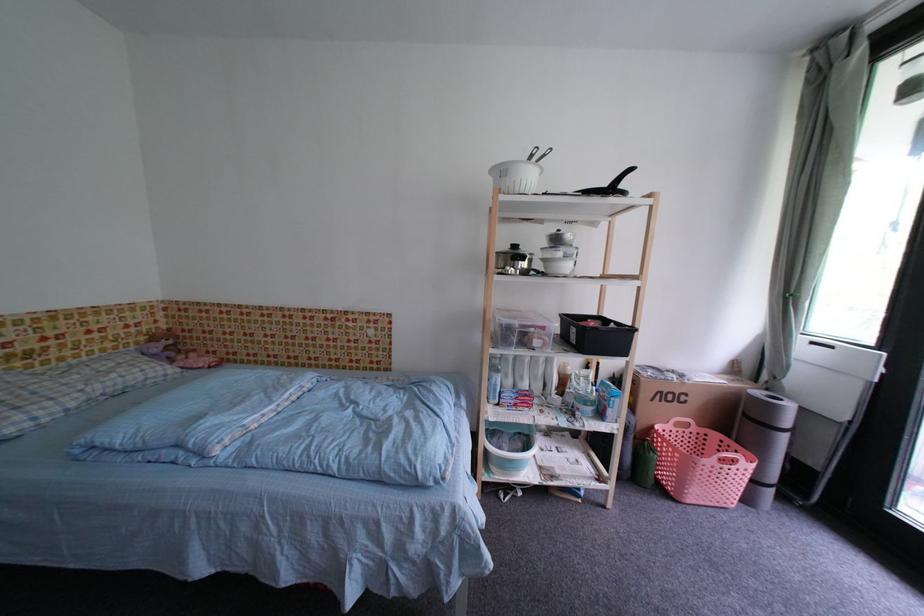
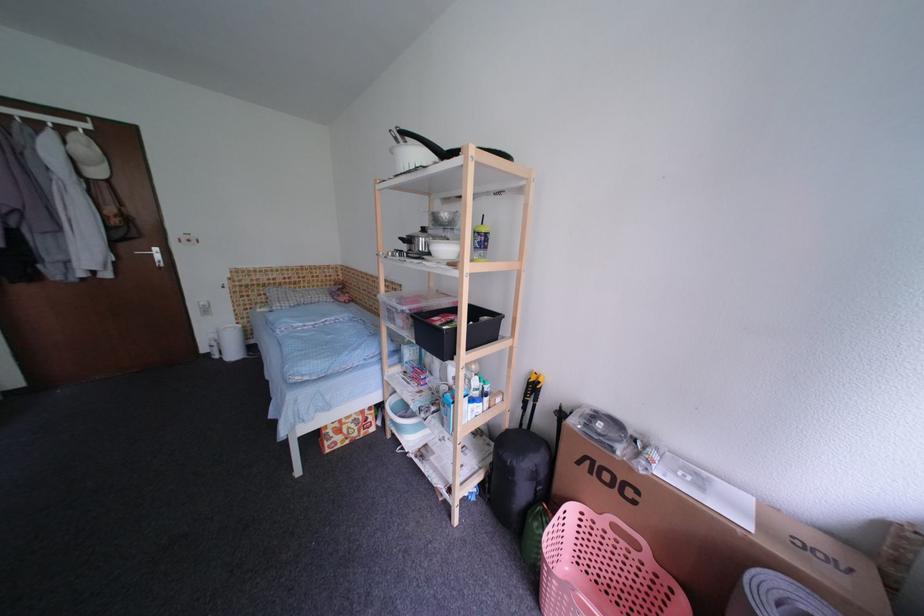
Where in the second image is the point corresponding to (576,238) from the first image?

(453, 217)